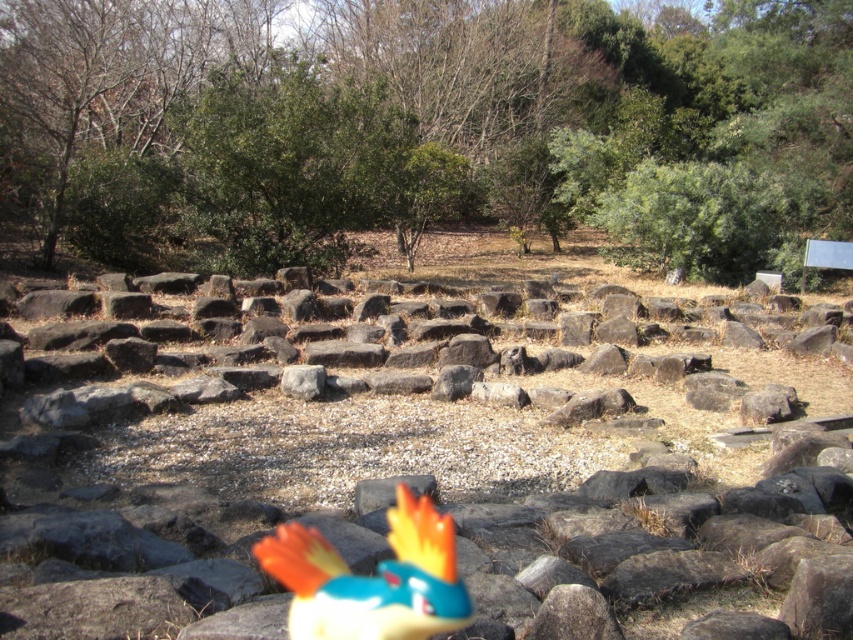
You are a small robot with a 1.5 meter reach. You want to pick up the shiny plastic bird at center from your current position. Can you reach it if you are standing next to the smooth gray rocks at center?

The distance between the smooth gray rocks at center and the shiny plastic bird at center is 2.67 meters. Since your reach is only 1.5 meters, you cannot reach the shiny plastic bird at center from the smooth gray rocks at center.

You are standing in the rocky area and want to take a photo of the green leafy tree at upper center and the smooth gray rocks at center. Which object should you position to the left side of your camera frame?

You should position the smooth gray rocks at center to the left side of your camera frame because the green leafy tree at upper center is to the right of the smooth gray rocks at center.

From the picture: You are an observer standing in the rocky area looking at the green leafy tree at upper center and the shiny plastic bird at center. Which object would appear bigger in your field of view?

The green leafy tree at upper center appears bigger in your field of view because it is larger in size than the shiny plastic bird at center.